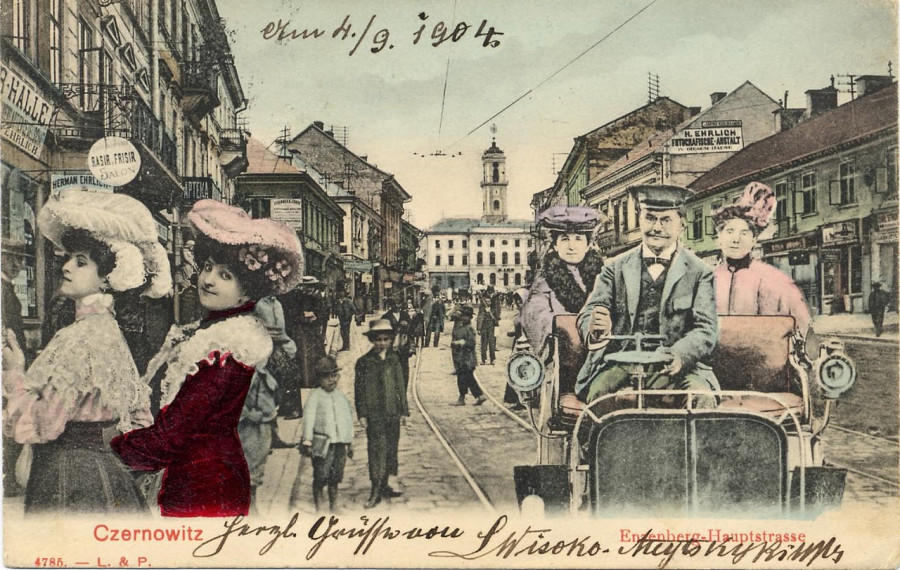
Where is `seat`? The image size is (900, 570). seat is located at coordinates (760, 344).